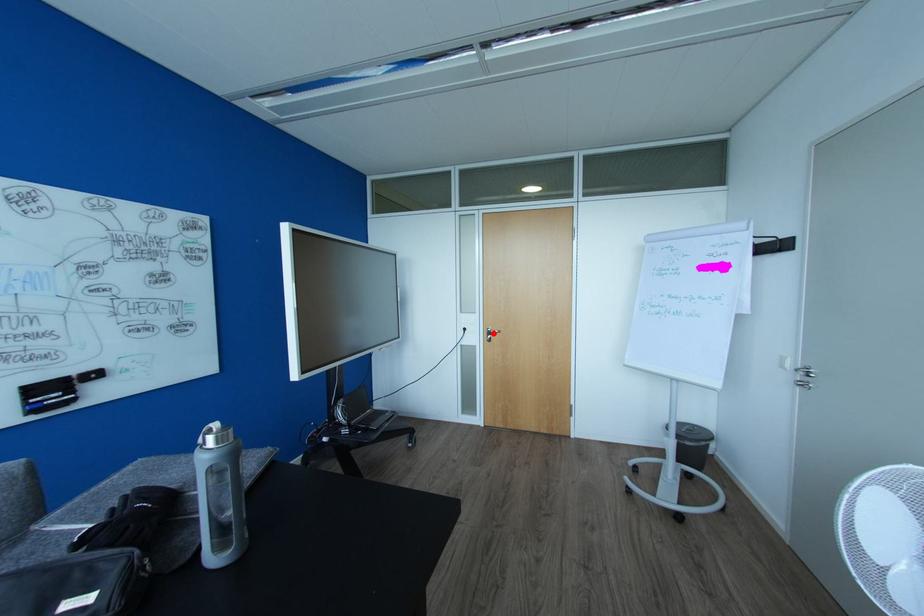
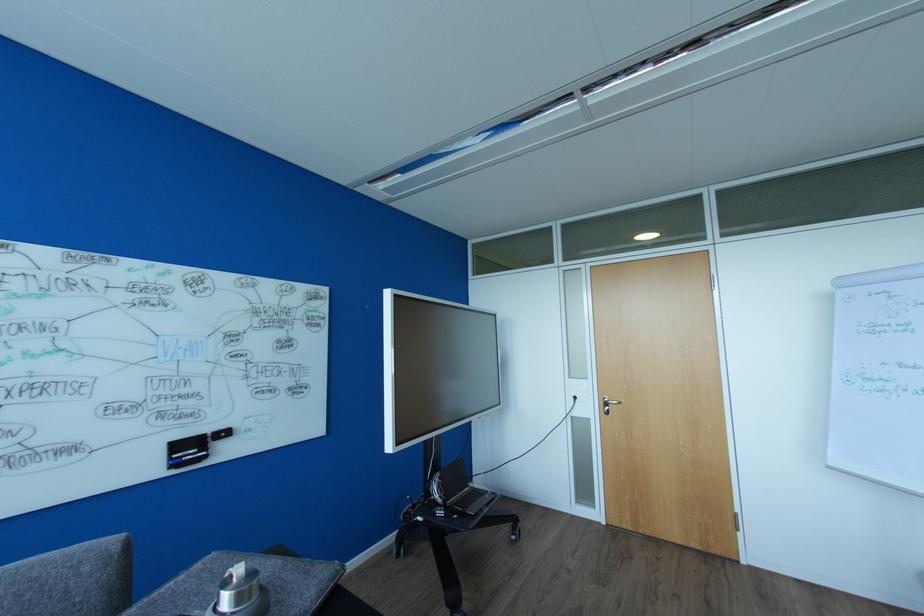
Question: I am providing you with two images of the same scene from different viewpoints. Given a red point in image1, look at the same physical point in image2. Is it:

Choices:
 (A) Closer to the viewpoint
 (B) Farther from the viewpoint

Answer: (B)